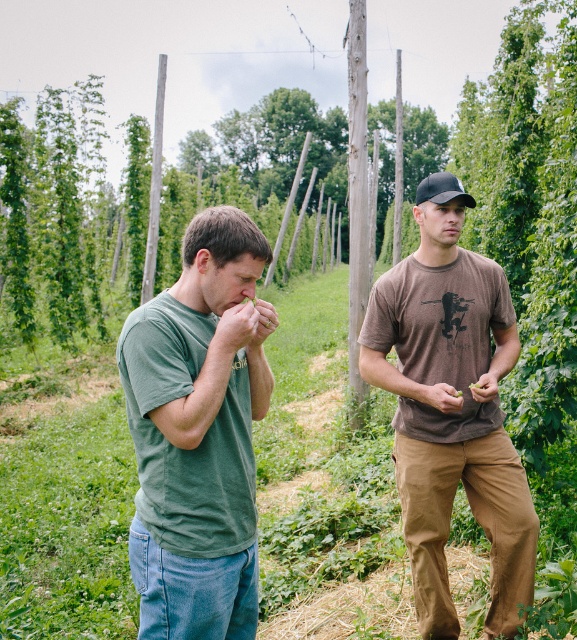
Based on the scene description, where exactly is the green cotton shirt at left located in the image?

The green cotton shirt at left is located at point (198, 433).

In the scene shown: You are standing in a hop field and see the green cotton shirt at left. If you want to take a photo of it with your smartphone camera, which has a minimum focus distance of 1 foot, will you be able to capture it clearly?

The green cotton shirt at left is 5.21 feet away from the camera, which is greater than the minimum focus distance of 1 foot. Therefore, the smartphone camera can capture it clearly.

You are standing at the origin of the coordinate system in the hop field. There are two points marked in the image. Which point is closer to you, point (503,342) or point (425,451)?

Point (425,451) is closer to you because it is in front of point (503,342).